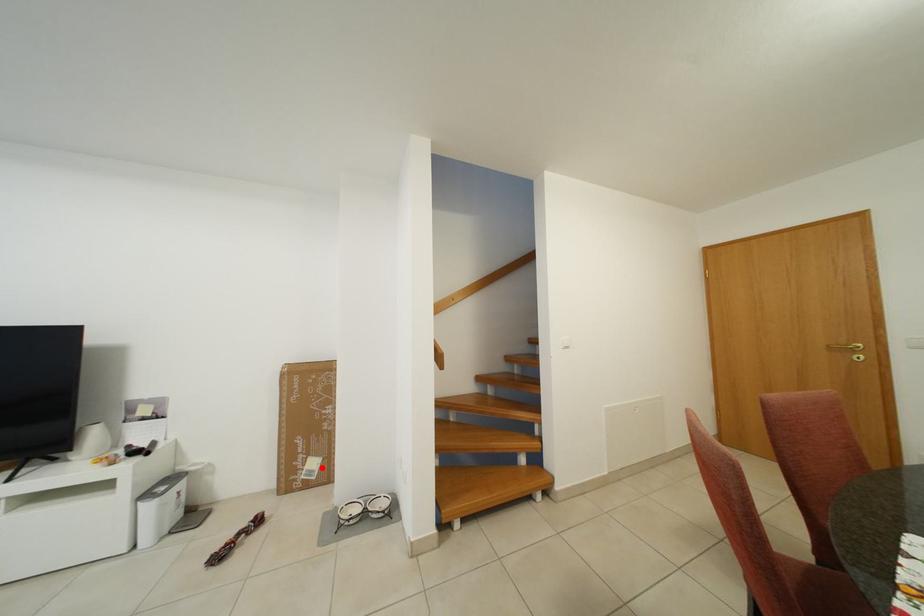
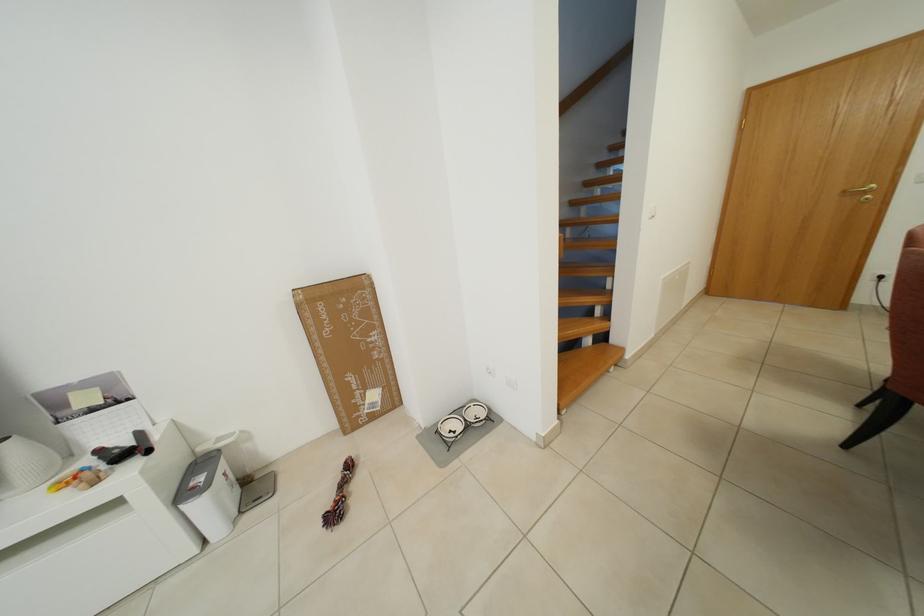
Question: I am providing you with two images of the same scene from different viewpoints. Given a red point in image1, look at the same physical point in image2. Is it:

Choices:
 (A) Closer to the viewpoint
 (B) Farther from the viewpoint

Answer: (A)